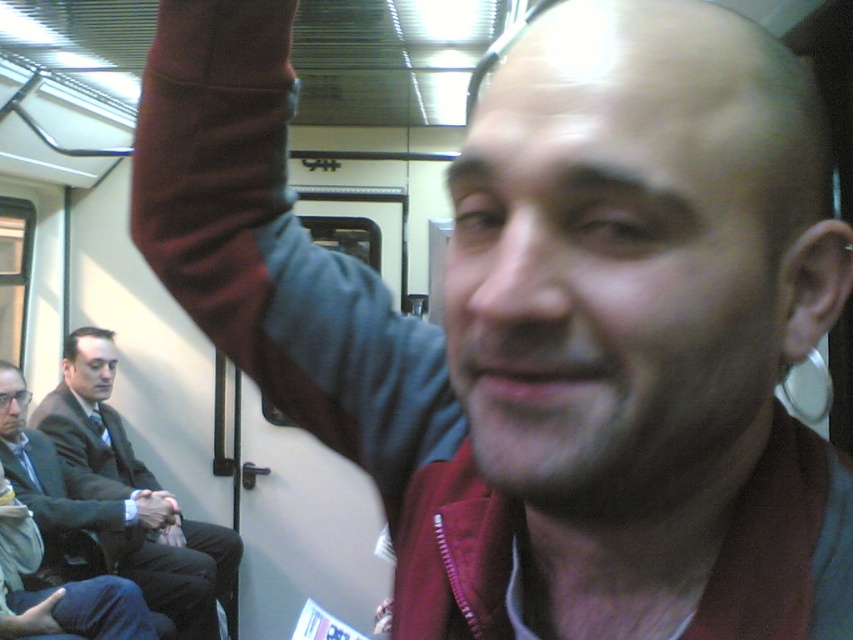
Is the position of bald head at center less distant than that of black suit coat at left?

Yes.

Which is behind, point (556, 490) or point (144, 486)?

The point (144, 486) is more distant.

What are the coordinates of `bald head at center` in the screenshot? It's located at (636, 253).

Who is higher up, bald head at center or maroon fabric arm at upper left?

maroon fabric arm at upper left is above.

Does bald head at center have a greater width compared to maroon fabric arm at upper left?

In fact, bald head at center might be narrower than maroon fabric arm at upper left.

Is point (485, 211) behind point (244, 35)?

No, it is in front of (244, 35).

This screenshot has width=853, height=640. Identify the location of bald head at center. (636, 253).

Is maroon fabric arm at upper left further to the viewer compared to brushed metal water at bottle left?

No, it is in front of brushed metal water at bottle left.

At what (x,y) coordinates should I click in order to perform the action: click on maroon fabric arm at upper left. Please return your answer as a coordinate pair (x, y). Looking at the image, I should click on (273, 248).

Is point (314, 252) less distant than point (73, 625)?

Yes, point (314, 252) is in front of point (73, 625).

The width and height of the screenshot is (853, 640). Identify the location of maroon fabric arm at upper left. [x=273, y=248].